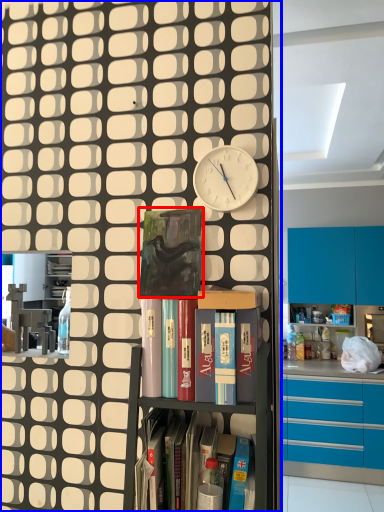
Question: Which point is closer to the camera, paperback book (highlighted by a red box) or cupboard (highlighted by a blue box)?

Choices:
 (A) paperback book
 (B) cupboard

Answer: (B)